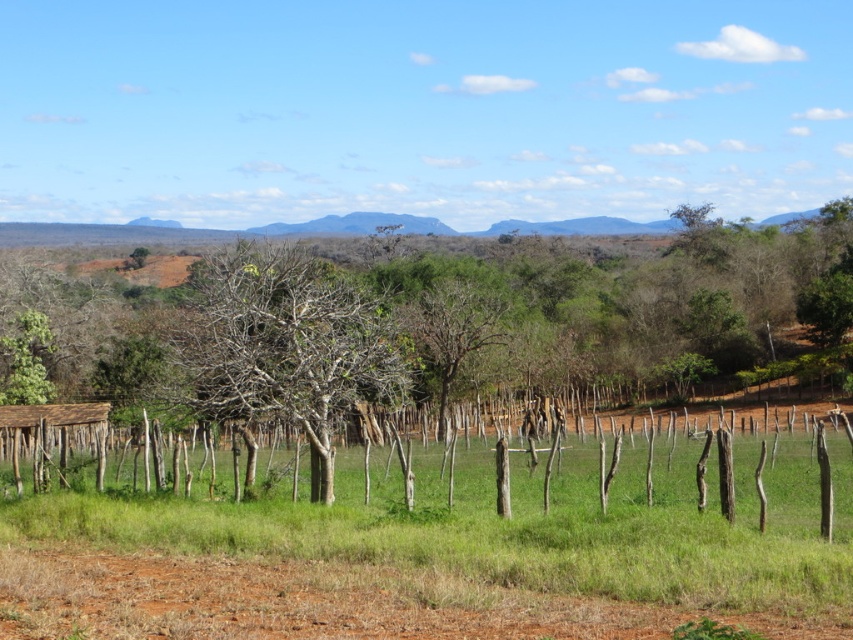
Question: Which object is the farthest from the brown wooden fence at center?

Choices:
 (A) brown dirt track at lower center
 (B) bare wood tree at center
 (C) brown wooden hut at lower left

Answer: (A)

Question: Can you confirm if brown wooden fence at center is positioned below brown dirt track at lower center?

Choices:
 (A) no
 (B) yes

Answer: (B)

Question: In this image, where is brown wooden fence at center located relative to bare wood tree at center?

Choices:
 (A) right
 (B) left

Answer: (A)

Question: In this image, where is brown dirt track at lower center located relative to brown wooden hut at lower left?

Choices:
 (A) below
 (B) above

Answer: (B)

Question: Estimate the real-world distances between objects in this image. Which object is closer to the brown wooden fence at center?

Choices:
 (A) brown wooden hut at lower left
 (B) brown dirt track at lower center

Answer: (A)

Question: Which point is closer to the camera?

Choices:
 (A) brown dirt track at lower center
 (B) brown wooden fence at center
 (C) brown wooden hut at lower left

Answer: (A)